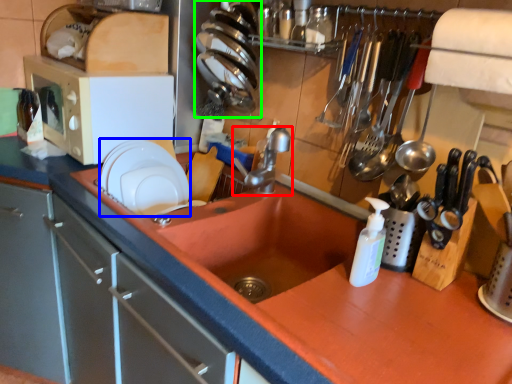
Question: Which object is the farthest from tap (highlighted by a red box)? Choose among these: tableware (highlighted by a blue box) or tableware (highlighted by a green box).

Choices:
 (A) tableware
 (B) tableware

Answer: (A)